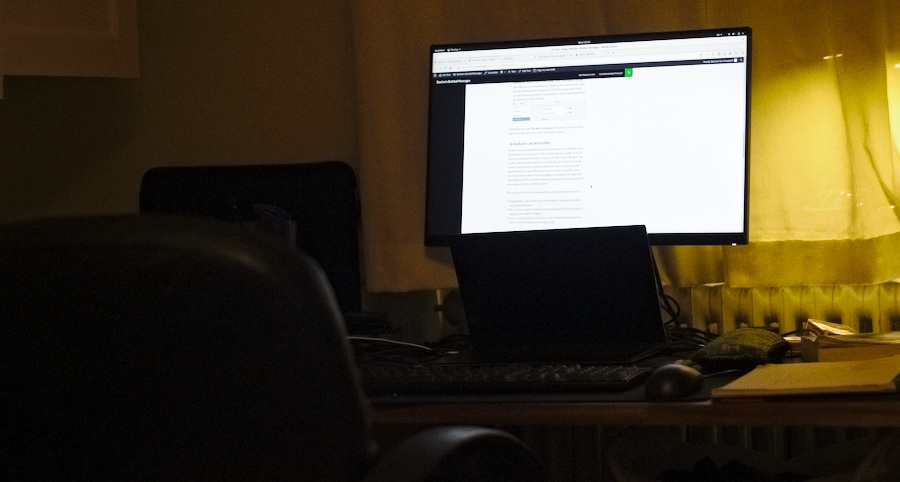
You are a GUI agent. You are given a task and a screenshot of the screen. Output one action in this format:
    pyautogui.click(x=<x>, y=<y>)
    Task: Click on the screen
    The height and width of the screenshot is (482, 900).
    Given the screenshot: What is the action you would take?
    pyautogui.click(x=716, y=131), pyautogui.click(x=606, y=258), pyautogui.click(x=304, y=202)